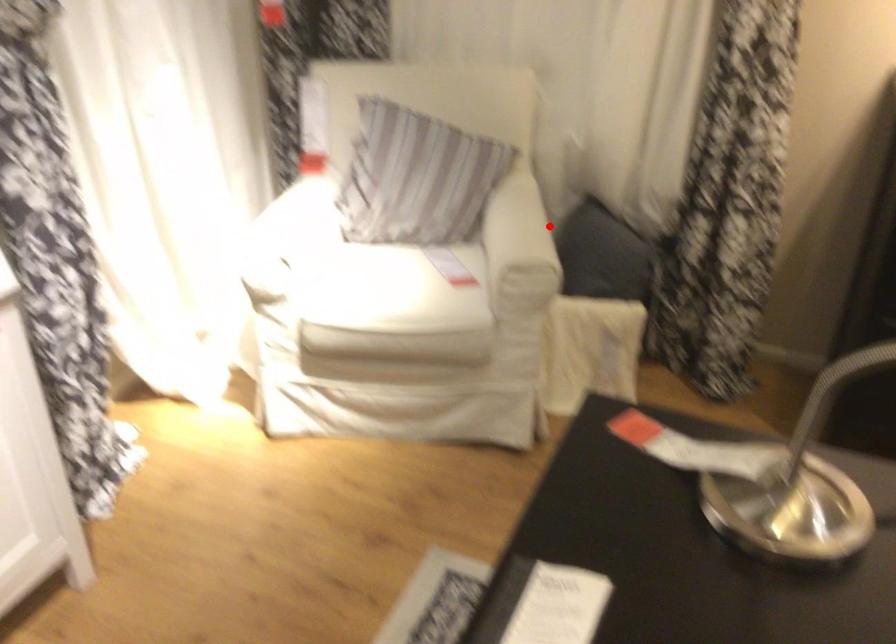
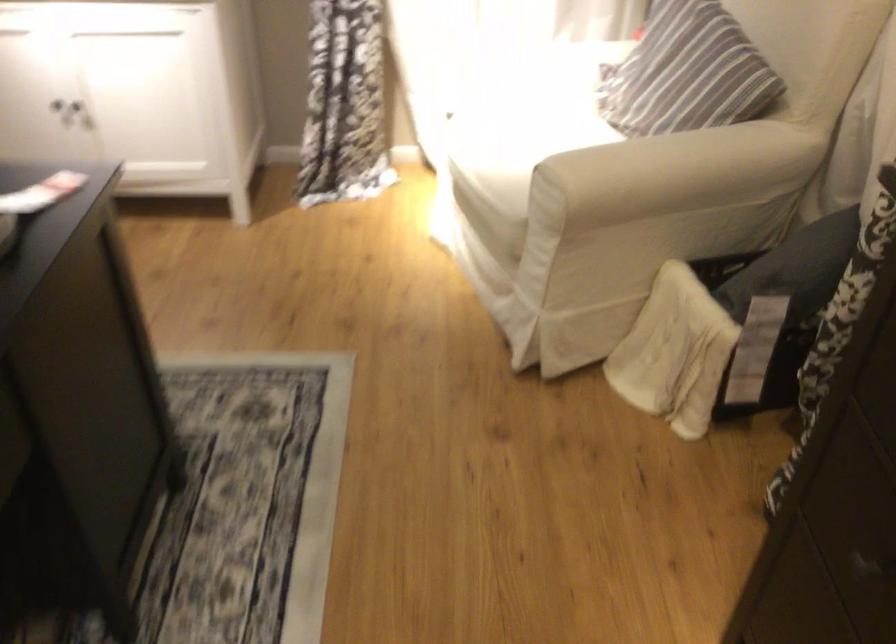
Find the pixel in the second image that matches the highlighted location in the first image.

(669, 169)